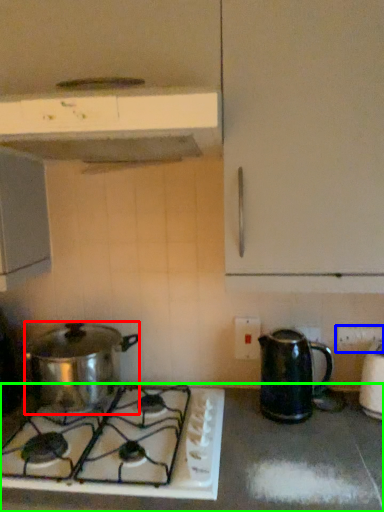
Question: Which is farther away from kitchen appliance (highlighted by a red box)? electric outlet (highlighted by a blue box) or countertop (highlighted by a green box)?

Choices:
 (A) electric outlet
 (B) countertop

Answer: (A)